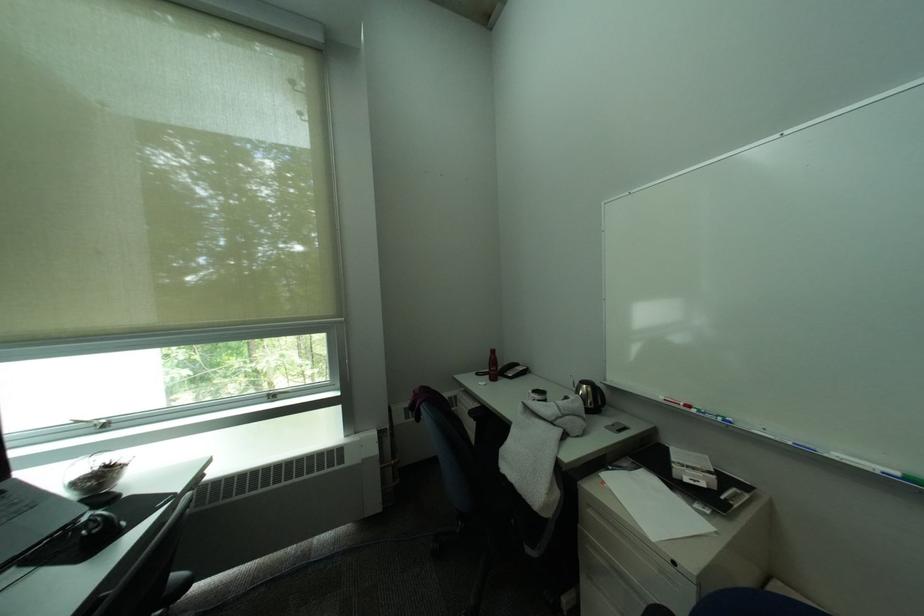
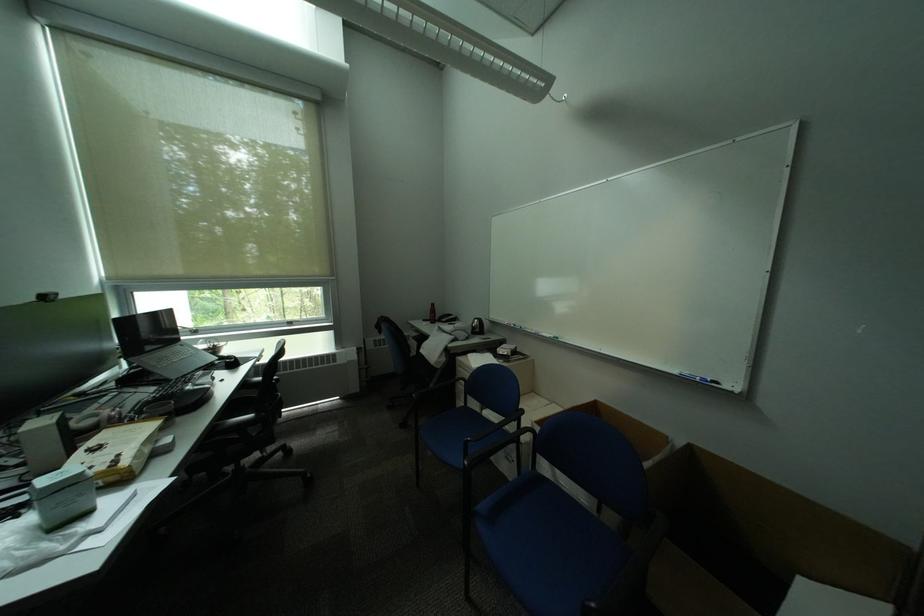
Question: Which direction would the cameraman need to move to produce the second image? Reply with the corresponding letter.

Choices:
 (A) Left
 (B) Right
 (C) Forward
 (D) Backward

Answer: (D)